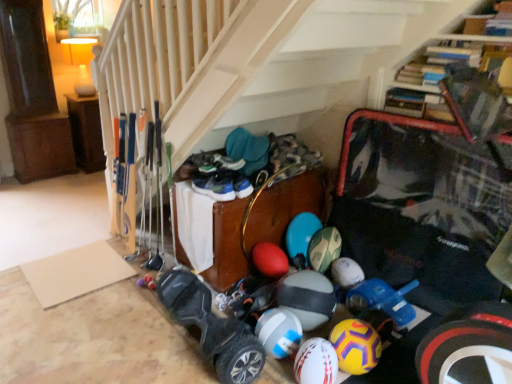
The image size is (512, 384). I want to click on brown wood cabinet at left, positioned as the second furniture in bottom-to-top order, so click(x=86, y=132).

This screenshot has height=384, width=512. Find the location of `white matte bowling ball at center, which is counted as the first bowling ball, starting from the left`. white matte bowling ball at center, which is counted as the first bowling ball, starting from the left is located at coordinates (279, 332).

What do you see at coordinates (212, 328) in the screenshot?
I see `black rubber hoverboard at lower center` at bounding box center [212, 328].

What do you see at coordinates (356, 346) in the screenshot?
I see `white matte bowling ball at lower center, which is counted as the third bowling ball, starting from the left` at bounding box center [356, 346].

What do you see at coordinates (316, 362) in the screenshot? This screenshot has height=384, width=512. I see `white matte bowling ball at center, acting as the 2th bowling ball starting from the left` at bounding box center [316, 362].

Find the location of a particular element. The width and height of the screenshot is (512, 384). brown wood cabinet at left, which is the 2th furniture in right-to-left order is located at coordinates (86, 132).

Is white matte bowling ball at lower center, which is counted as the third bowling ball, starting from the left, wider than white matte bowling ball at center, acting as the 2th bowling ball starting from the left?

Indeed, white matte bowling ball at lower center, which is counted as the third bowling ball, starting from the left, has a greater width compared to white matte bowling ball at center, acting as the 2th bowling ball starting from the left.

From the image's perspective, which one is positioned higher, white matte bowling ball at lower center, placed as the 1th bowling ball when sorted from right to left, or white matte bowling ball at center, the 2th bowling ball viewed from the right?

white matte bowling ball at lower center, placed as the 1th bowling ball when sorted from right to left, from the image's perspective.

Is white matte bowling ball at center, acting as the 2th bowling ball starting from the left, located within white matte bowling ball at lower center, placed as the 1th bowling ball when sorted from right to left?

That's incorrect, white matte bowling ball at center, acting as the 2th bowling ball starting from the left, is not inside white matte bowling ball at lower center, placed as the 1th bowling ball when sorted from right to left.

Which point is more distant from viewer, (353, 332) or (327, 351)?

The point (353, 332) is behind.

In the scene shown: Considering the sizes of objects brown wood cabinet at left, the first furniture positioned from the back, and black rubber hoverboard at lower center in the image provided, who is thinner, brown wood cabinet at left, the first furniture positioned from the back, or black rubber hoverboard at lower center?

black rubber hoverboard at lower center.

Would you say brown wood cabinet at left, which is the 1th furniture from left to right, contains black rubber hoverboard at lower center?

That's incorrect, black rubber hoverboard at lower center is not inside brown wood cabinet at left, which is the 1th furniture from left to right.

From a real-world perspective, which is physically below, brown wood cabinet at left, the first furniture positioned from the back, or black rubber hoverboard at lower center?

black rubber hoverboard at lower center, from a real-world perspective.

Considering the sizes of objects brown wood cabinet at left, which is the 1th furniture from left to right, and black rubber hoverboard at lower center in the image provided, who is taller, brown wood cabinet at left, which is the 1th furniture from left to right, or black rubber hoverboard at lower center?

brown wood cabinet at left, which is the 1th furniture from left to right.

Who is taller, white matte bowling ball at center, which ranks as the 3th bowling ball in right-to-left order, or white matte bowling ball at center, the 2th bowling ball viewed from the right?

white matte bowling ball at center, the 2th bowling ball viewed from the right, is taller.

Is there a large distance between white matte bowling ball at center, which ranks as the 3th bowling ball in right-to-left order, and white matte bowling ball at center, acting as the 2th bowling ball starting from the left?

No.

From the image's perspective, which one is positioned lower, white matte bowling ball at center, which ranks as the 3th bowling ball in right-to-left order, or white matte bowling ball at center, acting as the 2th bowling ball starting from the left?

From the image's view, white matte bowling ball at center, acting as the 2th bowling ball starting from the left, is below.

Is white rubber beach ball at center taller or shorter than black rubber hoverboard at lower center?

white rubber beach ball at center is shorter than black rubber hoverboard at lower center.

Is white rubber beach ball at center facing towards black rubber hoverboard at lower center?

Yes, white rubber beach ball at center is oriented towards black rubber hoverboard at lower center.

From a real-world perspective, which object rests below the other?

black rubber hoverboard at lower center, from a real-world perspective.

The height and width of the screenshot is (384, 512). In order to click on beach ball behind the black rubber hoverboard at lower center in this screenshot , I will do `click(308, 298)`.

In terms of height, does wooden chest at center, the first furniture viewed from the front, look taller or shorter compared to black rubber hoverboard at lower center?

In the image, wooden chest at center, the first furniture viewed from the front, appears to be taller than black rubber hoverboard at lower center.

Considering the positions of points (285, 216) and (214, 317), is point (285, 216) closer to camera compared to point (214, 317)?

No, it is behind (214, 317).

How different are the orientations of wooden chest at center, the second furniture viewed from the left, and black rubber hoverboard at lower center in degrees?

They differ by 96.4 degrees in their facing directions.

Is wooden chest at center, the second furniture positioned from the back, positioned beyond the bounds of black rubber hoverboard at lower center?

That's correct, wooden chest at center, the second furniture positioned from the back, is outside of black rubber hoverboard at lower center.

Is white matte bowling ball at lower center, placed as the 1th bowling ball when sorted from right to left, oriented towards white matte bowling ball at center, which ranks as the 3th bowling ball in right-to-left order?

No.

Measure the distance from white matte bowling ball at lower center, which is counted as the third bowling ball, starting from the left, to white matte bowling ball at center, which ranks as the 3th bowling ball in right-to-left order.

white matte bowling ball at lower center, which is counted as the third bowling ball, starting from the left, is 8.88 inches from white matte bowling ball at center, which ranks as the 3th bowling ball in right-to-left order.

Is white matte bowling ball at lower center, which is counted as the third bowling ball, starting from the left, far away from white matte bowling ball at center, which ranks as the 3th bowling ball in right-to-left order?

white matte bowling ball at lower center, which is counted as the third bowling ball, starting from the left, is actually quite close to white matte bowling ball at center, which ranks as the 3th bowling ball in right-to-left order.

From the image's perspective, is white matte bowling ball at lower center, which is counted as the third bowling ball, starting from the left, on top of white matte bowling ball at center, which is counted as the first bowling ball, starting from the left?

No, from the image's perspective, white matte bowling ball at lower center, which is counted as the third bowling ball, starting from the left, is not on top of white matte bowling ball at center, which is counted as the first bowling ball, starting from the left.

Between white rubber beach ball at center and brown wood cabinet at left, which is the 1th furniture from top to bottom, which one appears on the right side from the viewer's perspective?

From the viewer's perspective, white rubber beach ball at center appears more on the right side.

Consider the image. Does white rubber beach ball at center have a lesser height compared to brown wood cabinet at left, which is the 1th furniture from top to bottom?

Yes.

Who is bigger, white rubber beach ball at center or brown wood cabinet at left, which is the 1th furniture from left to right?

brown wood cabinet at left, which is the 1th furniture from left to right, is bigger.

From the image's perspective, is white rubber beach ball at center beneath brown wood cabinet at left, positioned as the second furniture in bottom-to-top order?

Yes.

This screenshot has height=384, width=512. Identify the location of bowling ball that appears in front of the white matte bowling ball at lower center, placed as the 1th bowling ball when sorted from right to left. (316, 362).

At what (x,y) coordinates should I click in order to perform the action: click on the 2nd furniture located above the black rubber hoverboard at lower center (from a real-world perspective). Please return your answer as a coordinate pair (x, y). The image size is (512, 384). Looking at the image, I should click on (86, 132).

Considering their positions, is white matte bowling ball at lower center, which is counted as the third bowling ball, starting from the left, positioned further to white rubber beach ball at center than brown wood cabinet at left, placed as the 2th furniture when sorted from front to back?

The object further to white rubber beach ball at center is brown wood cabinet at left, placed as the 2th furniture when sorted from front to back.

In the scene shown: When comparing their distances from wooden chest at center, which is the first furniture in right-to-left order, does brown wood cabinet at left, placed as the 2th furniture when sorted from front to back, or white matte bowling ball at center, acting as the 2th bowling ball starting from the left, seem further?

Based on the image, brown wood cabinet at left, placed as the 2th furniture when sorted from front to back, appears to be further to wooden chest at center, which is the first furniture in right-to-left order.

Based on their spatial positions, is white matte bowling ball at center, the 2th bowling ball viewed from the right, or wooden chest at center, the 1th furniture positioned from the bottom, further from white matte bowling ball at lower center, placed as the 1th bowling ball when sorted from right to left?

wooden chest at center, the 1th furniture positioned from the bottom.

Based on their spatial positions, is white rubber beach ball at center or white matte bowling ball at center, which ranks as the 3th bowling ball in right-to-left order, further from black rubber hoverboard at lower center?

Among the two, white rubber beach ball at center is located further to black rubber hoverboard at lower center.

In the scene shown: When comparing their distances from white rubber beach ball at center, does white matte bowling ball at lower center, placed as the 1th bowling ball when sorted from right to left, or white matte bowling ball at center, acting as the 2th bowling ball starting from the left, seem closer?

Among the two, white matte bowling ball at lower center, placed as the 1th bowling ball when sorted from right to left, is located nearer to white rubber beach ball at center.

Which object lies nearer to the anchor point black rubber hoverboard at lower center, white matte bowling ball at center, the 2th bowling ball viewed from the right, or white rubber beach ball at center?

white matte bowling ball at center, the 2th bowling ball viewed from the right, lies closer to black rubber hoverboard at lower center than the other object.

Looking at the image, which one is located further to wooden chest at center, the 1th furniture positioned from the bottom, white rubber beach ball at center or black rubber hoverboard at lower center?

Based on the image, black rubber hoverboard at lower center appears to be further to wooden chest at center, the 1th furniture positioned from the bottom.

Considering their positions, is black rubber hoverboard at lower center positioned further to wooden chest at center, which is the first furniture in right-to-left order, than white matte bowling ball at center, which ranks as the 3th bowling ball in right-to-left order?

Among the two, white matte bowling ball at center, which ranks as the 3th bowling ball in right-to-left order, is located further to wooden chest at center, which is the first furniture in right-to-left order.

Where is `wide between white matte bowling ball at center, acting as the 2th bowling ball starting from the left, and brown wood cabinet at left, which is the 1th furniture from top to bottom, from front to back`? wide between white matte bowling ball at center, acting as the 2th bowling ball starting from the left, and brown wood cabinet at left, which is the 1th furniture from top to bottom, from front to back is located at coordinates coord(212,328).

Locate an element on the screen. The image size is (512, 384). bowling ball between black rubber hoverboard at lower center and white matte bowling ball at center, acting as the 2th bowling ball starting from the left, in the horizontal direction is located at coordinates (279, 332).

At what (x,y) coordinates should I click in order to perform the action: click on furniture between black rubber hoverboard at lower center and brown wood cabinet at left, which is the 1th furniture from top to bottom, along the z-axis. Please return your answer as a coordinate pair (x, y). This screenshot has height=384, width=512. Looking at the image, I should click on (262, 223).

Where is `beach ball between wooden chest at center, the 2th furniture from the top, and white matte bowling ball at lower center, which is counted as the third bowling ball, starting from the left, in the up-down direction`? beach ball between wooden chest at center, the 2th furniture from the top, and white matte bowling ball at lower center, which is counted as the third bowling ball, starting from the left, in the up-down direction is located at coordinates (308, 298).